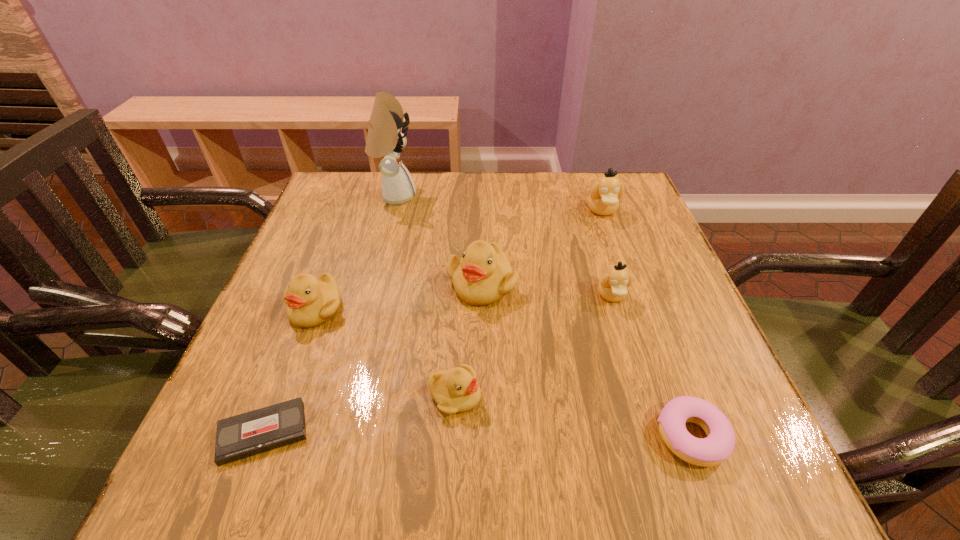
At what (x,y) coordinates should I click in order to perform the action: click on vacant area that lies between the shortest duckling and the leftmost yellow duckling. Please return your answer as a coordinate pair (x, y). This screenshot has width=960, height=540. Looking at the image, I should click on (385, 352).

At what (x,y) coordinates should I click in order to perform the action: click on free space that is in between the biggest yellow duckling and the bigger tan duckling. Please return your answer as a coordinate pair (x, y). The image size is (960, 540). Looking at the image, I should click on click(x=542, y=247).

Locate an element on the screen. The width and height of the screenshot is (960, 540). free space that is in between the biggest yellow duckling and the doll is located at coordinates (439, 240).

Find the location of `vacant space in between the biggest yellow duckling and the nearer tan duckling`. vacant space in between the biggest yellow duckling and the nearer tan duckling is located at coordinates (547, 289).

Find the location of a particular element. vacant area between the biggest yellow duckling and the doughnut is located at coordinates (587, 360).

Identify the location of empty space between the nearer tan duckling and the farther tan duckling. [x=607, y=253].

I want to click on empty location between the farthest duckling and the videotape, so click(433, 321).

The height and width of the screenshot is (540, 960). I want to click on free spot between the biggest yellow duckling and the farthest duckling, so click(542, 247).

The width and height of the screenshot is (960, 540). In order to click on unoccupied position between the biggest yellow duckling and the seventh tallest object in this screenshot , I will do `click(587, 360)`.

Select which object appears as the third closest to the videotape. Please provide its 2D coordinates. Your answer should be formatted as a tuple, i.e. [(x, y)], where the tuple contains the x and y coordinates of a point satisfying the conditions above.

[(483, 276)]